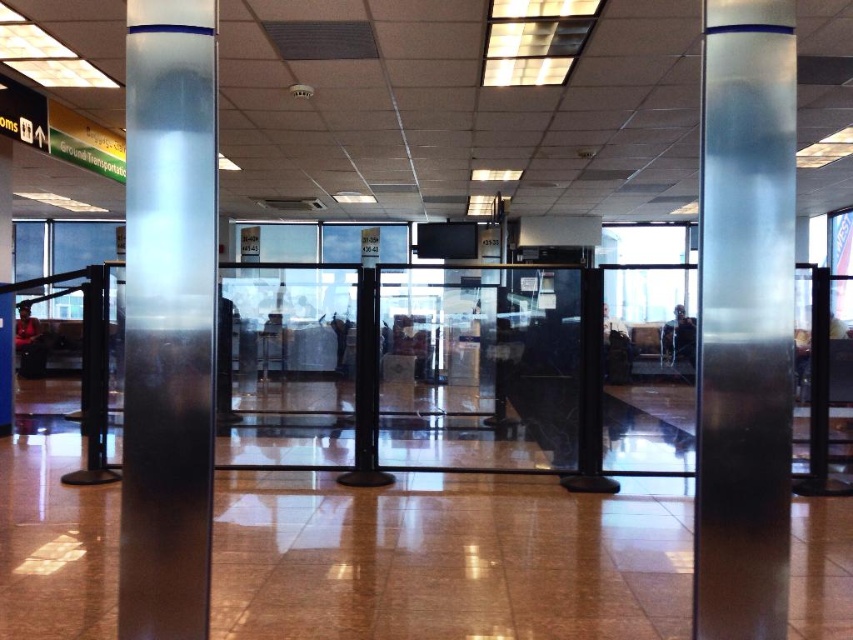
Between satin silver column at center and satin silver pole at center, which one is positioned lower?

satin silver column at center is below.

Is satin silver column at center smaller than satin silver pole at center?

Actually, satin silver column at center might be larger than satin silver pole at center.

This screenshot has width=853, height=640. What do you see at coordinates (744, 321) in the screenshot? I see `satin silver column at center` at bounding box center [744, 321].

At what (x,y) coordinates should I click in order to perform the action: click on satin silver column at center. Please return your answer as a coordinate pair (x, y). This screenshot has height=640, width=853. Looking at the image, I should click on (744, 321).